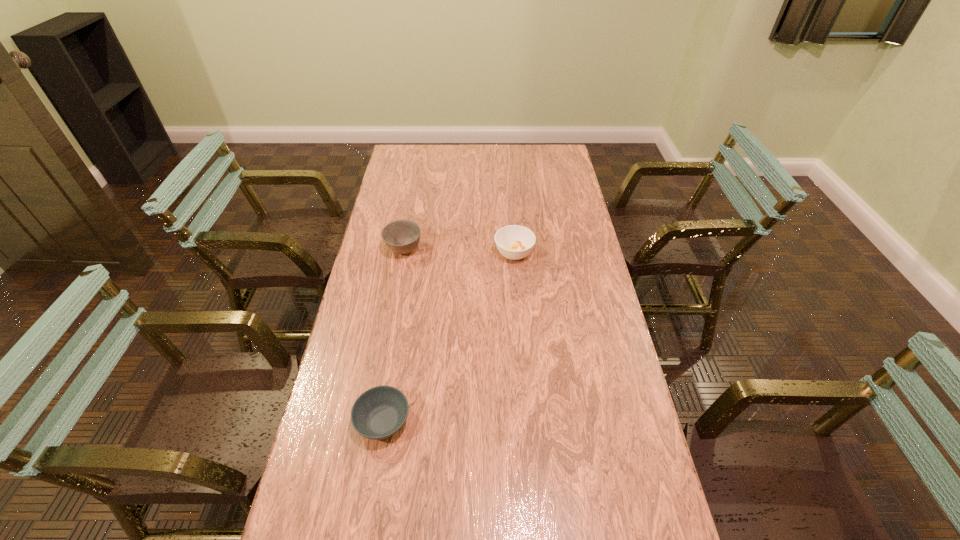
Identify the location of vacant area at the far edge. (444, 156).

Find the location of a particular element. Image resolution: width=960 pixels, height=540 pixels. free spot at the left edge of the desktop is located at coordinates (360, 369).

Identify the location of vacant space at the right edge of the desktop. The width and height of the screenshot is (960, 540). (584, 448).

The image size is (960, 540). Find the location of `vacant space at the far left corner of the desktop`. vacant space at the far left corner of the desktop is located at coordinates (408, 147).

This screenshot has width=960, height=540. In the image, there is a desktop. Identify the location of vacant space at the far right corner. (537, 164).

You are a GUI agent. You are given a task and a screenshot of the screen. Output one action in this format:
    pyautogui.click(x=<x>, y=<y>)
    Task: Click on the vacant area that lies between the left soup bowl and the bowl
    Image resolution: width=960 pixels, height=540 pixels.
    Given the screenshot: What is the action you would take?
    point(394,335)

This screenshot has width=960, height=540. I want to click on free space between the bowl and the farther soup bowl, so click(x=459, y=251).

The width and height of the screenshot is (960, 540). What are the coordinates of `free space between the right soup bowl and the bowl` in the screenshot? It's located at (459, 251).

In order to click on vacant space in between the nearest object and the bowl in this screenshot , I will do `click(394, 335)`.

Identify the location of object that stands as the second closest to the nearest object. (514, 242).